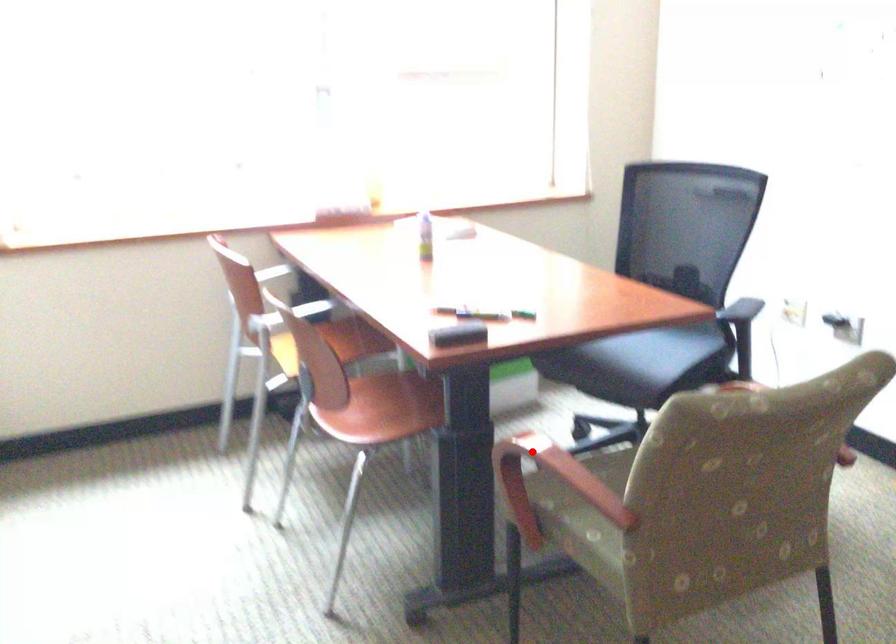
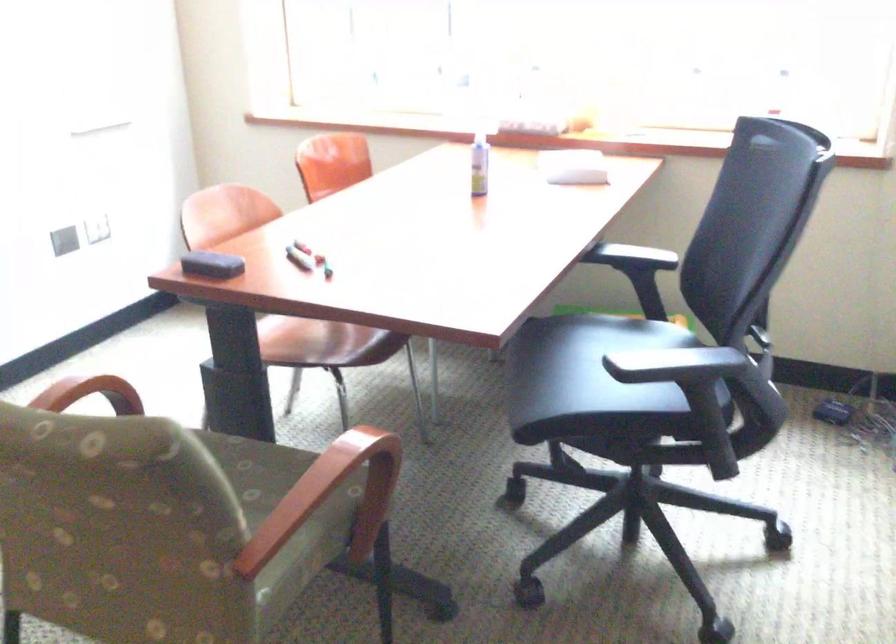
Find the pixel in the second image that matches the highlighted location in the first image.

(90, 393)